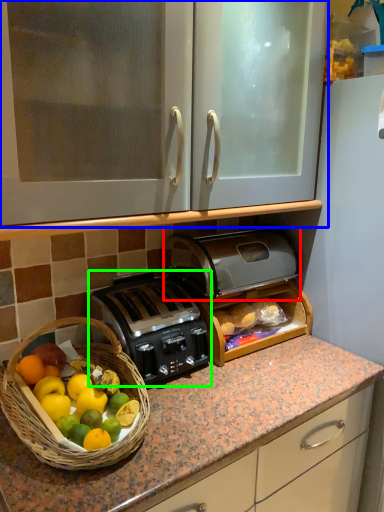
Question: Estimate the real-world distances between objects in this image. Which object is closer to toaster (highlighted by a red box), cabinetry (highlighted by a blue box) or toaster (highlighted by a green box)?

Choices:
 (A) cabinetry
 (B) toaster

Answer: (B)